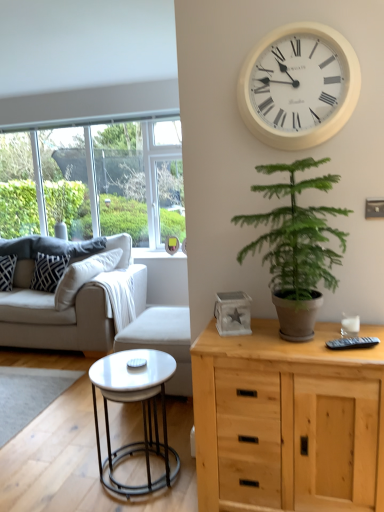
The image size is (384, 512). I want to click on vacant space behind black plastic remote at right, so click(x=344, y=338).